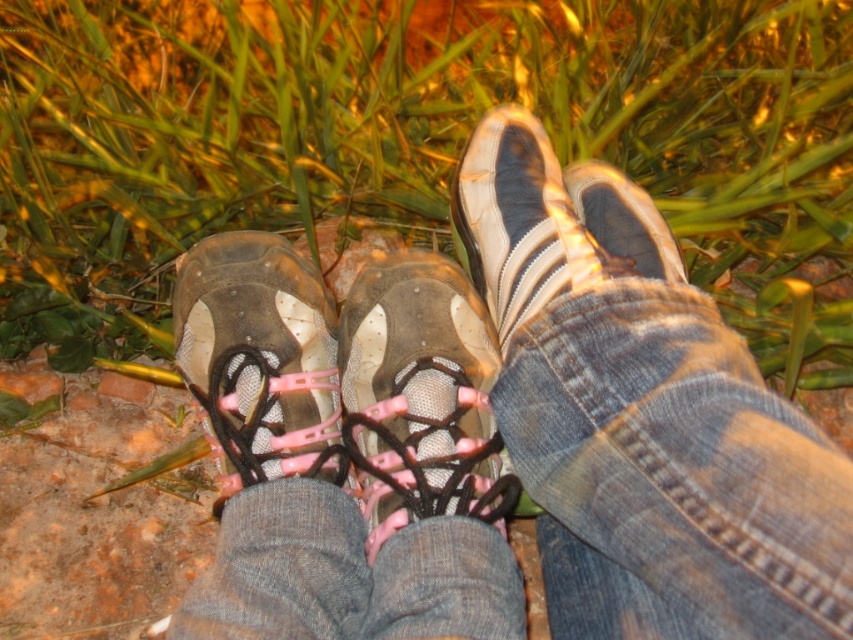
You are trying to decide which pair of shoes to take for a hike. Both the matte mesh shoe at center and the matte rubber shoe at center are options. Based on their sizes, which one might be more comfortable for carrying heavier gear?

The matte rubber shoe at center is larger than the matte mesh shoe at center, so it might provide more comfort when carrying heavier gear due to its larger size.

Consider the image. You are trying to decide which shoe to wear for a hike. You notice the matte mesh shoe at center and the white matte shoe at center in the image. Based on their heights, which one would be more suitable for uneven terrain?

The matte mesh shoe at center has a greater height compared to the white matte shoe at center, making it more suitable for uneven terrain as higher shoes often provide better ankle support.

You are a photographer setting up a shot of two shoes on grass. The matte mesh shoe at center and the matte rubber shoe at center must be exactly 10 cm apart for the composition. Currently, they are 9.18 cm apart. What adjustment should you make?

The distance between the matte mesh shoe at center and the matte rubber shoe at center is currently 9.18 centimeters. To reach the required 10 cm, you should move them slightly apart from each other.